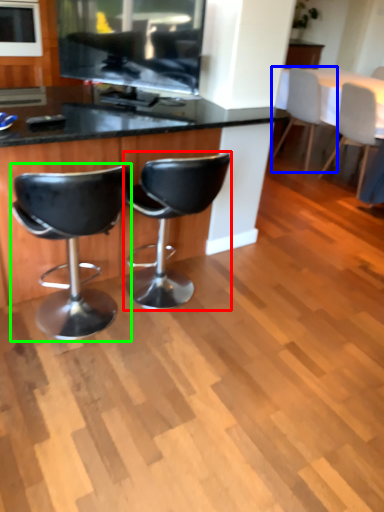
Question: Considering the real-world distances, which object is farthest from chair (highlighted by a red box)? chair (highlighted by a blue box) or chair (highlighted by a green box)?

Choices:
 (A) chair
 (B) chair

Answer: (A)